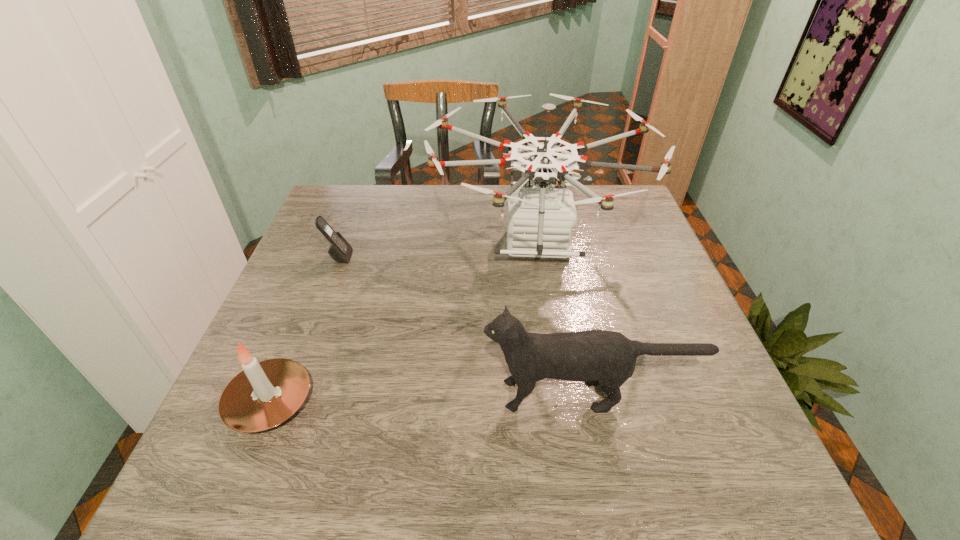
Where is `the tallest object`? The width and height of the screenshot is (960, 540). the tallest object is located at coordinates (540, 218).

At what (x,y) coordinates should I click in order to perform the action: click on cat. Please return your answer as a coordinate pair (x, y). This screenshot has width=960, height=540. Looking at the image, I should click on (606, 358).

Locate an element on the screen. candle is located at coordinates (265, 394).

Identify the location of cellular telephone. (340, 250).

The height and width of the screenshot is (540, 960). I want to click on vacant space situated 0.310m on the left of the drone, so click(318, 244).

Image resolution: width=960 pixels, height=540 pixels. Find the location of `free spot located on the front-facing side of the third shortest object`. free spot located on the front-facing side of the third shortest object is located at coordinates point(442,395).

Where is `vacant space located on the front-facing side of the third shortest object`? The height and width of the screenshot is (540, 960). vacant space located on the front-facing side of the third shortest object is located at coordinates (279, 395).

Find the location of a particular element. vacant space located 0.070m on the front-facing side of the third shortest object is located at coordinates (446, 395).

Locate an element on the screen. This screenshot has width=960, height=540. vacant space located on the back of the second shortest object is located at coordinates (309, 304).

Locate an element on the screen. This screenshot has height=540, width=960. free space located on the front-facing side of the shortest object is located at coordinates (496, 257).